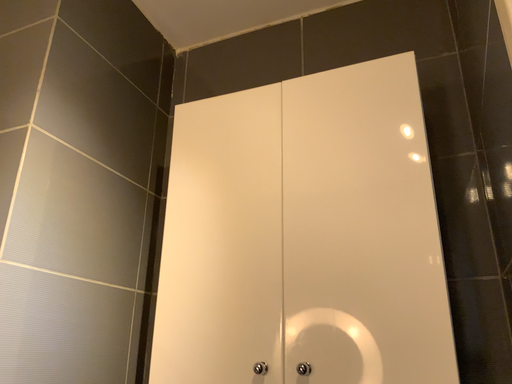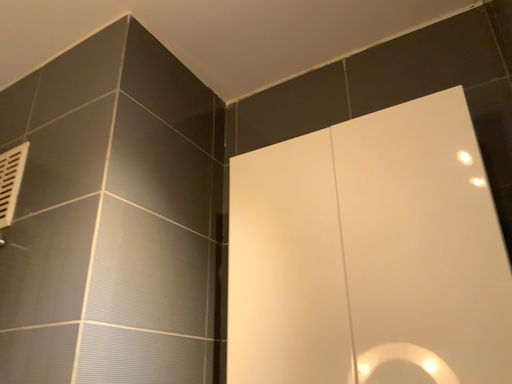
Question: Which way did the camera rotate in the video?

Choices:
 (A) rotated right
 (B) rotated left

Answer: (B)